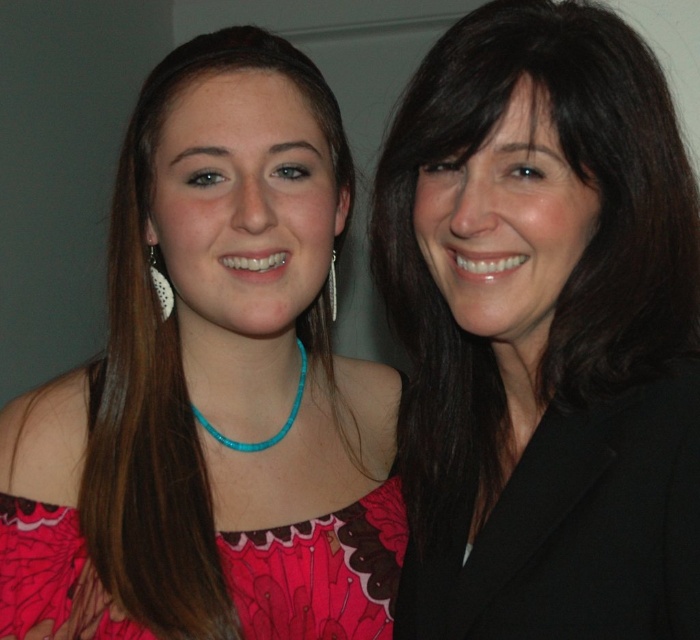
Which is behind, point (200, 593) or point (281, 566)?

Point (281, 566)

Describe the element at coordinates (211, 387) in the screenshot. This screenshot has width=700, height=640. I see `pink fabric dress at center` at that location.

Find the location of a particular element. Image resolution: width=700 pixels, height=640 pixels. pink fabric dress at center is located at coordinates (211, 387).

Is point (162, 276) positioned behind point (336, 307)?

No.

Is pearl-like textured earring at left to the right of silver metallic earring at center from the viewer's perspective?

No, pearl-like textured earring at left is not to the right of silver metallic earring at center.

I want to click on pearl-like textured earring at left, so click(161, 284).

This screenshot has width=700, height=640. In order to click on pearl-like textured earring at left in this screenshot , I will do `click(161, 284)`.

Is pink floral fabric dress at lower left shorter than pearl-like textured earring at left?

No, pink floral fabric dress at lower left is not shorter than pearl-like textured earring at left.

Does pink floral fabric dress at lower left appear under pearl-like textured earring at left?

Yes.

Find the location of a particular element. This screenshot has width=700, height=640. pink floral fabric dress at lower left is located at coordinates (318, 572).